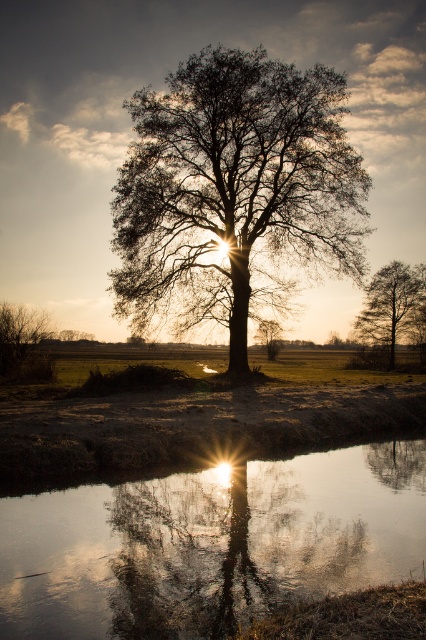
You are a photographer planning to take a photo of the silhouette leafy tree at center and the green matte bush at lower left. Which object should you focus on first if you want to capture both in a single frame without adjusting your camera angle?

The silhouette leafy tree at center should be focused on first since it is taller than the green matte bush at lower left, allowing you to frame both effectively without adjusting the camera angle.

In the scene shown: You are standing at the edge of the scene and want to walk towards the silhouette leafy tree at center. Which direction should you walk to avoid stepping on the transparent reflective water at center?

You should walk to the right side of the silhouette leafy tree at center because the transparent reflective water at center is on its left side.